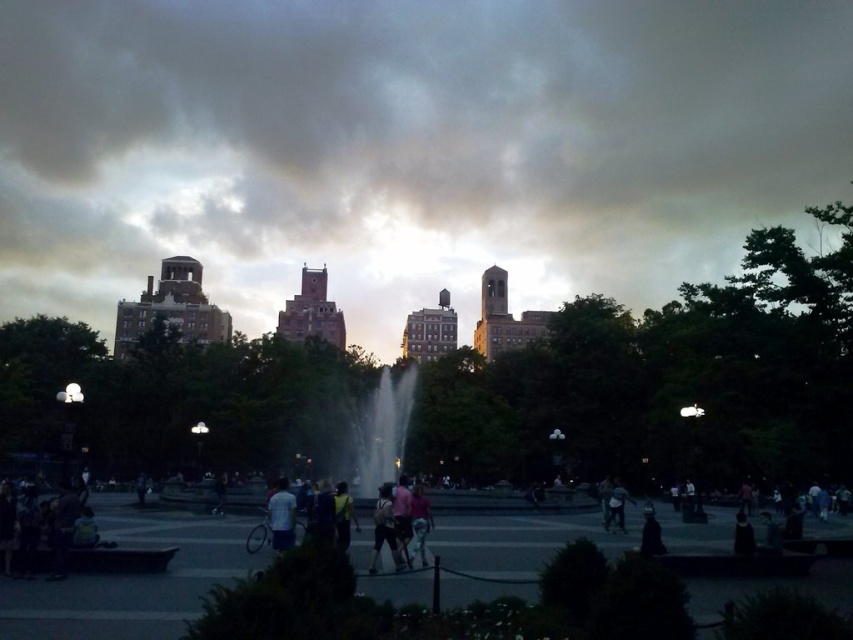
You are a photographer trying to capture a clear shot of the matte pink shirt at center and the dark fabric jacket at lower right. Since you want both subjects to be visible, which one should you focus on to ensure the other remains in the background?

You should focus on the matte pink shirt at center because it is in front of the dark fabric jacket at lower right, so if you focus on the matte pink shirt at center, the dark fabric jacket at lower right will naturally be in the background and still visible.

You are a photographer standing at the edge of the park, looking towards the fountain. You see a person wearing a matte pink shirt at center and another wearing a dark fabric jacket at lower right. Which clothing item is positioned higher in the scene?

The matte pink shirt at center is above the dark fabric jacket at lower right, so the matte pink shirt at center is positioned higher in the scene.